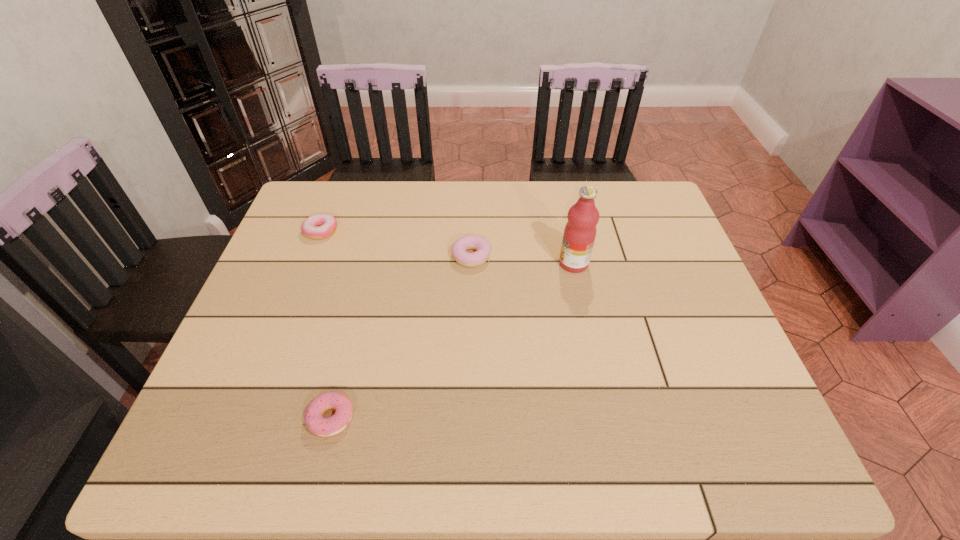
Locate an element on the screen. vacant region that satisfies the following two spatial constraints: 1. on the label of the rightmost object; 2. on the front side of the nearest doughnut is located at coordinates (607, 418).